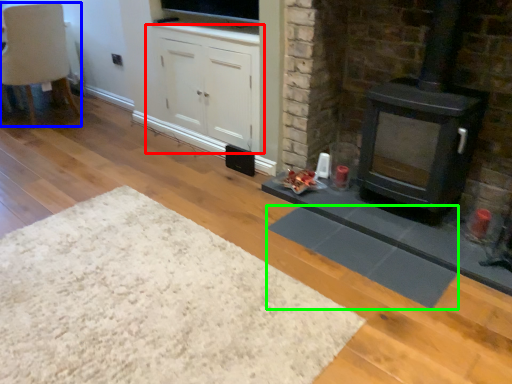
Question: Which object is positioned farthest from cabinetry (highlighted by a red box)? Select from chair (highlighted by a blue box) and mat (highlighted by a green box).

Choices:
 (A) chair
 (B) mat

Answer: (A)